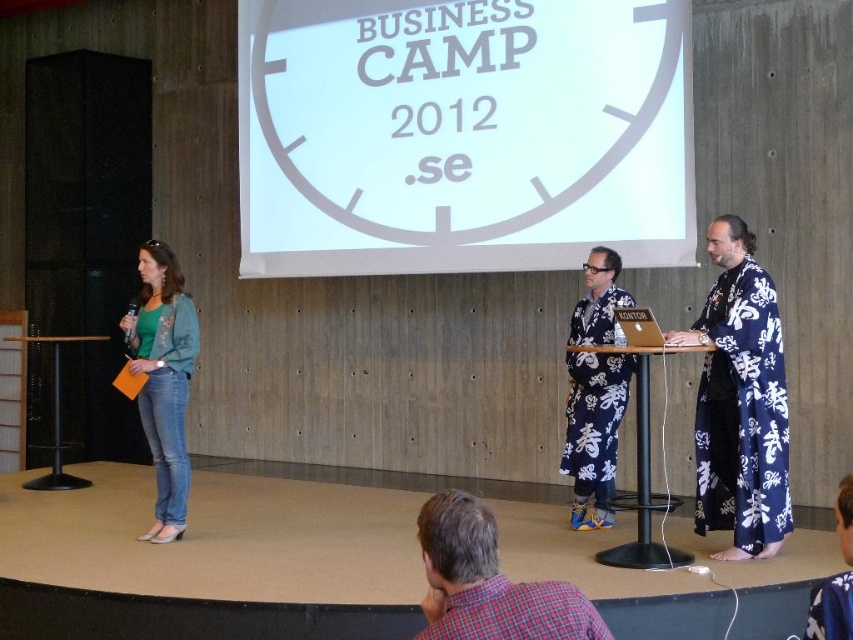
Is blue floral kimono at center to the right of green textured robe at left from the viewer's perspective?

Yes, blue floral kimono at center is to the right of green textured robe at left.

Does blue floral kimono at center have a greater width compared to green textured robe at left?

No, blue floral kimono at center is not wider than green textured robe at left.

Who is more distant from viewer, (573, 328) or (152, 444)?

The point (573, 328) is behind.

Where is `blue floral kimono at center`? This screenshot has width=853, height=640. blue floral kimono at center is located at coordinates (595, 420).

Is white paper at upper center wider than blue floral kimono at center?

Yes.

I want to click on white paper at upper center, so click(462, 134).

Is white paper at upper center smaller than blue floral robe at center?

No.

Can you confirm if white paper at upper center is positioned above blue floral robe at center?

Indeed, white paper at upper center is positioned over blue floral robe at center.

Where is `white paper at upper center`? The width and height of the screenshot is (853, 640). white paper at upper center is located at coordinates (462, 134).